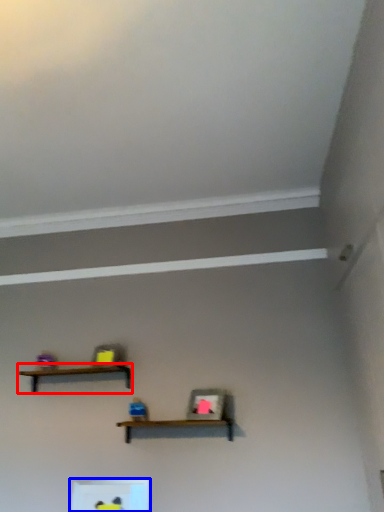
Question: Among these objects, which one is nearest to the camera, shelf (highlighted by a red box) or shelf (highlighted by a blue box)?

Choices:
 (A) shelf
 (B) shelf

Answer: (B)